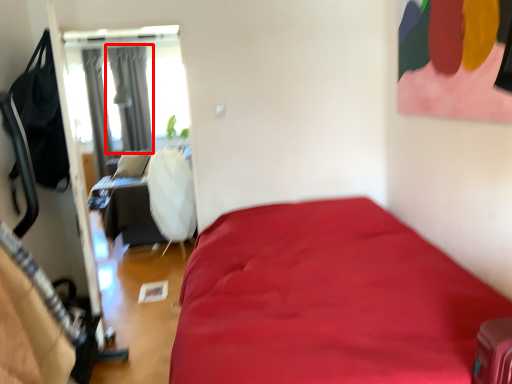
Question: From the image's perspective, considering the relative positions of curtain (annotated by the red box) and curtain in the image provided, where is curtain (annotated by the red box) located with respect to the staircase?

Choices:
 (A) above
 (B) below

Answer: (A)